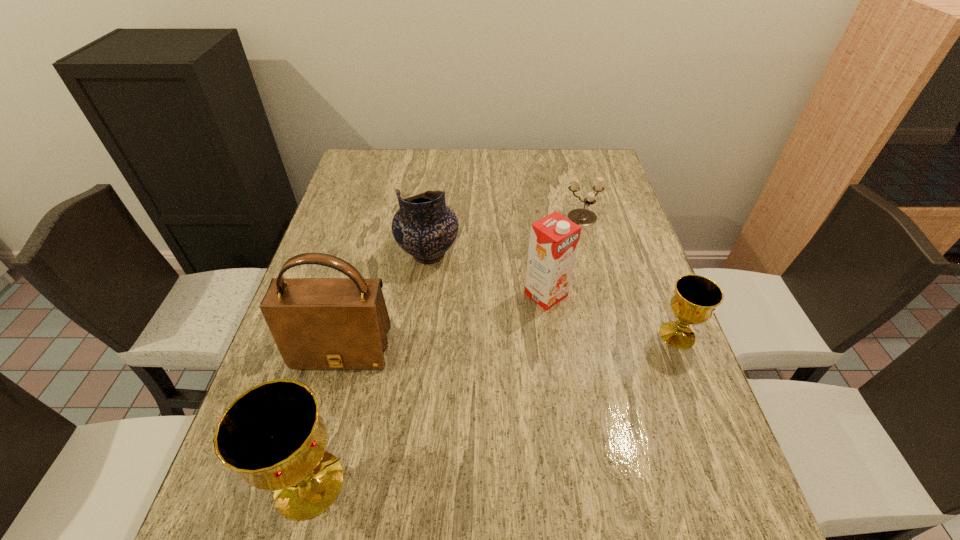
Locate an element on the screen. This screenshot has width=960, height=540. candle holder that is at the right edge is located at coordinates (583, 217).

The width and height of the screenshot is (960, 540). I want to click on object located in the near left corner section of the desktop, so click(272, 435).

Image resolution: width=960 pixels, height=540 pixels. I want to click on free spot at the far edge of the desktop, so click(543, 180).

I want to click on vacant space at the near edge, so click(551, 464).

The height and width of the screenshot is (540, 960). Find the location of `vacant space at the left edge`. vacant space at the left edge is located at coordinates (317, 251).

Locate an element on the screen. Image resolution: width=960 pixels, height=540 pixels. blank space at the right edge is located at coordinates (662, 404).

This screenshot has width=960, height=540. In the image, there is a desktop. In order to click on vacant space at the far right corner in this screenshot , I will do `click(598, 154)`.

You are a GUI agent. You are given a task and a screenshot of the screen. Output one action in this format:
    pyautogui.click(x=<x>, y=<y>)
    Task: Click on the free space between the tallest object and the rightmost object
    This screenshot has width=960, height=540.
    Given the screenshot: What is the action you would take?
    pyautogui.click(x=510, y=343)

Find the location of `empty space between the shoulder bag and the carton`. empty space between the shoulder bag and the carton is located at coordinates (444, 323).

Image resolution: width=960 pixels, height=540 pixels. I want to click on unoccupied position between the shoulder bag and the candle holder, so click(x=463, y=285).